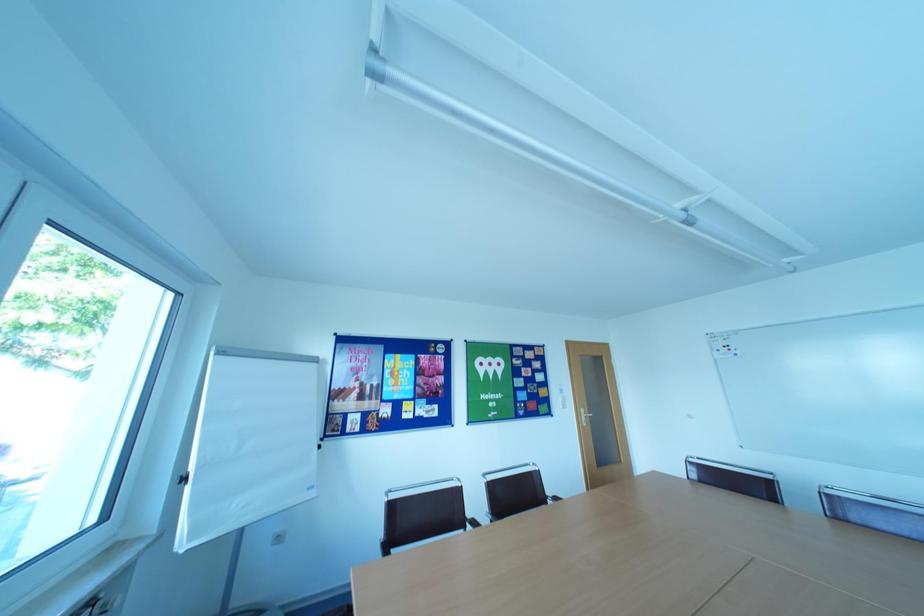
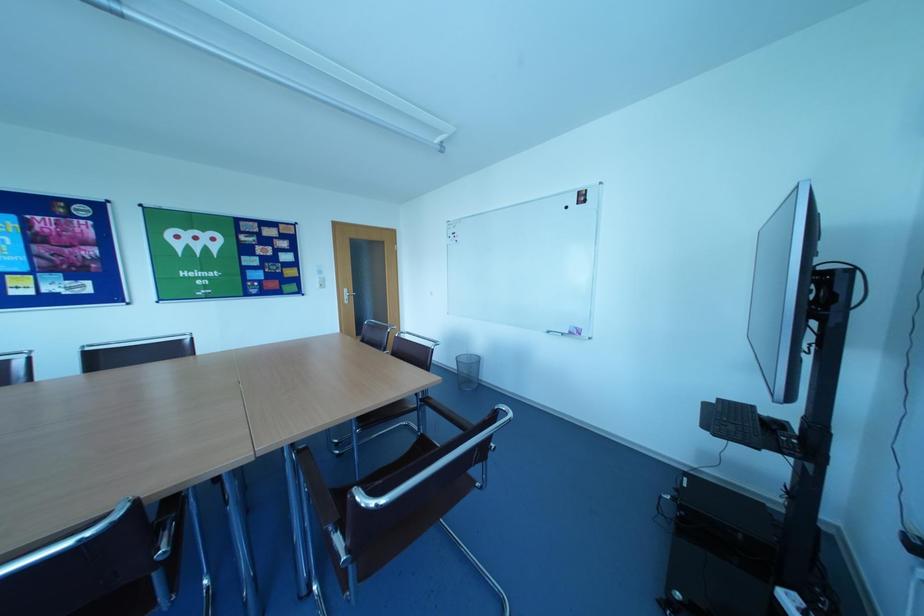
Question: In a continuous first-person perspective shot, in which direction is the camera moving?

Choices:
 (A) Left
 (B) Right
 (C) Forward
 (D) Backward

Answer: (B)